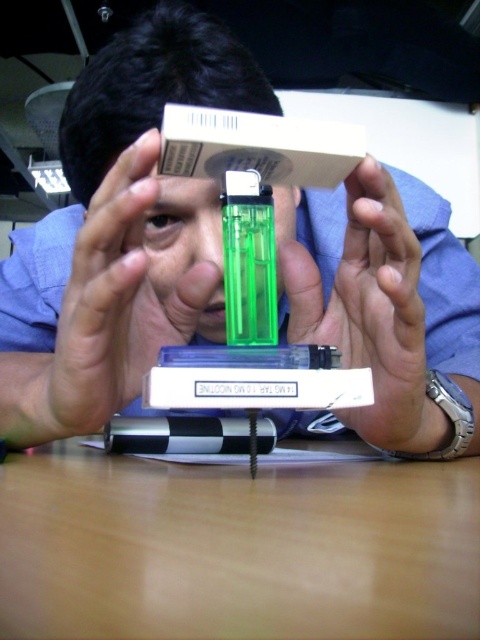
Measure the distance between point (422,492) and camera.

Point (422,492) and camera are 13.03 inches apart from each other.

Is brown matte table at center further to the viewer compared to green plastic head at center?

No, it is in front of green plastic head at center.

Where is `brown matte table at center`? The image size is (480, 640). brown matte table at center is located at coordinates (236, 548).

Identify the location of brown matte table at center. Image resolution: width=480 pixels, height=640 pixels. (236, 548).

Does transparent plastic lighter at center appear under green plastic lighter at center?

Yes, transparent plastic lighter at center is below green plastic lighter at center.

Does transparent plastic lighter at center have a larger size compared to green plastic lighter at center?

Indeed, transparent plastic lighter at center has a larger size compared to green plastic lighter at center.

Image resolution: width=480 pixels, height=640 pixels. I want to click on transparent plastic lighter at center, so click(120, 234).

Can you confirm if matte green plastic lighter at center is positioned to the left of green plastic head at center?

No, matte green plastic lighter at center is not to the left of green plastic head at center.

Where is `matte green plastic lighter at center`? matte green plastic lighter at center is located at coordinates (371, 312).